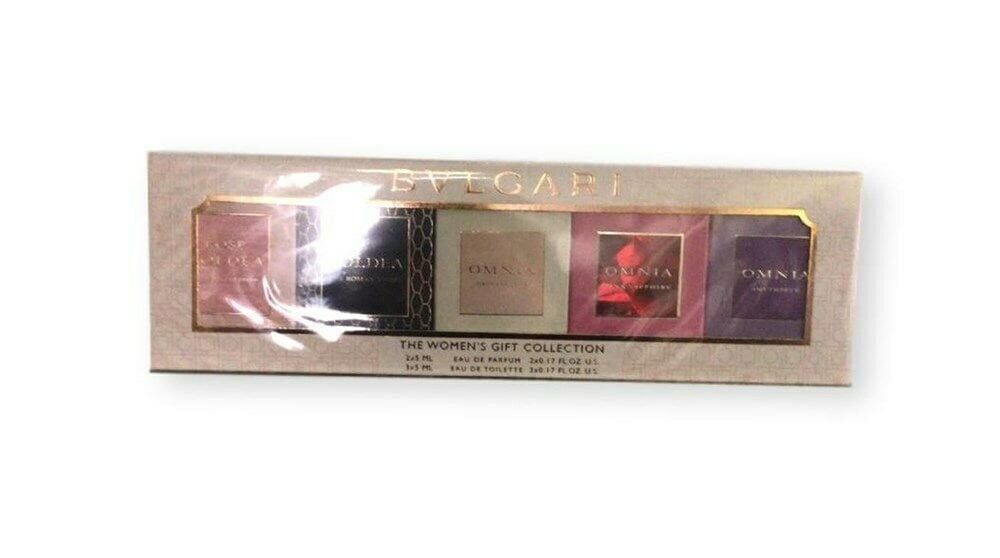
Find the location of a particular element. Image resolution: width=1000 pixels, height=558 pixels. box is located at coordinates (674, 324).